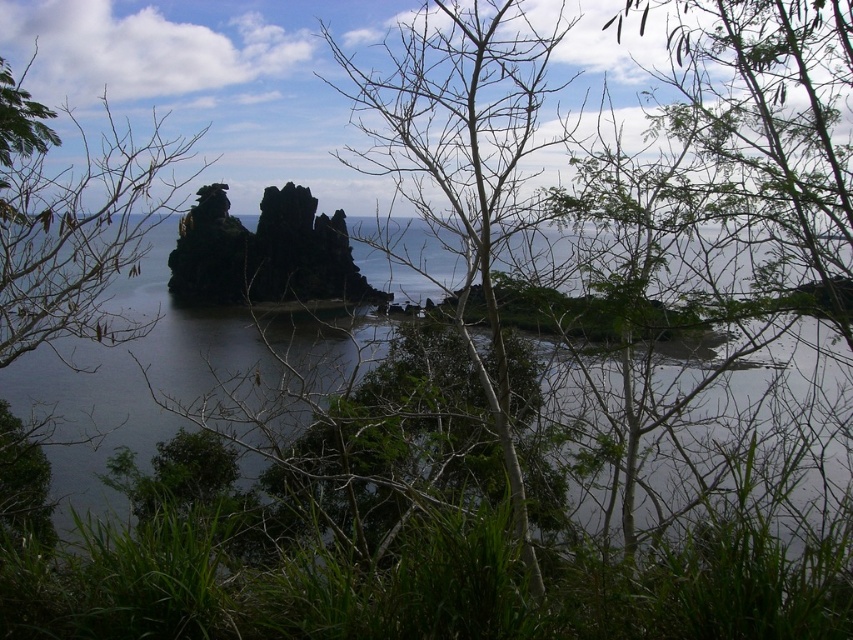
Question: Can you confirm if bare branches at center is positioned above brown leafless branches at upper left?

Choices:
 (A) no
 (B) yes

Answer: (A)

Question: Which of the following is the closest to the observer?

Choices:
 (A) transparent water at center
 (B) dark brown rock formation at center
 (C) brown leafless branches at upper left

Answer: (C)

Question: Can you confirm if transparent water at center is positioned below bare branches at center?

Choices:
 (A) yes
 (B) no

Answer: (B)

Question: Which point appears farthest from the camera in this image?

Choices:
 (A) (523, 36)
 (B) (334, 248)
 (C) (78, 404)

Answer: (B)

Question: Which point is closer to the camera?

Choices:
 (A) transparent water at center
 (B) bare branches at center

Answer: (B)

Question: Is transparent water at center further to the viewer compared to brown leafless branches at upper left?

Choices:
 (A) no
 (B) yes

Answer: (B)